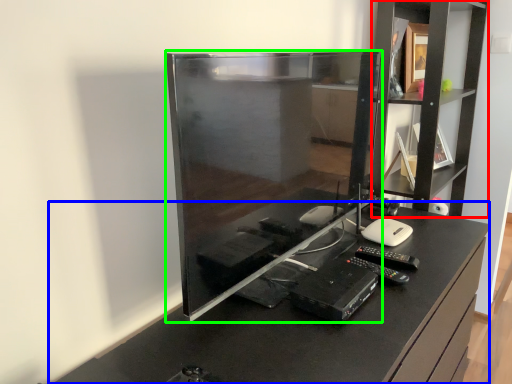
Question: Considering the real-world distances, which object is farthest from shelf (highlighted by a red box)? furniture (highlighted by a blue box) or desktop computer (highlighted by a green box)?

Choices:
 (A) furniture
 (B) desktop computer

Answer: (B)